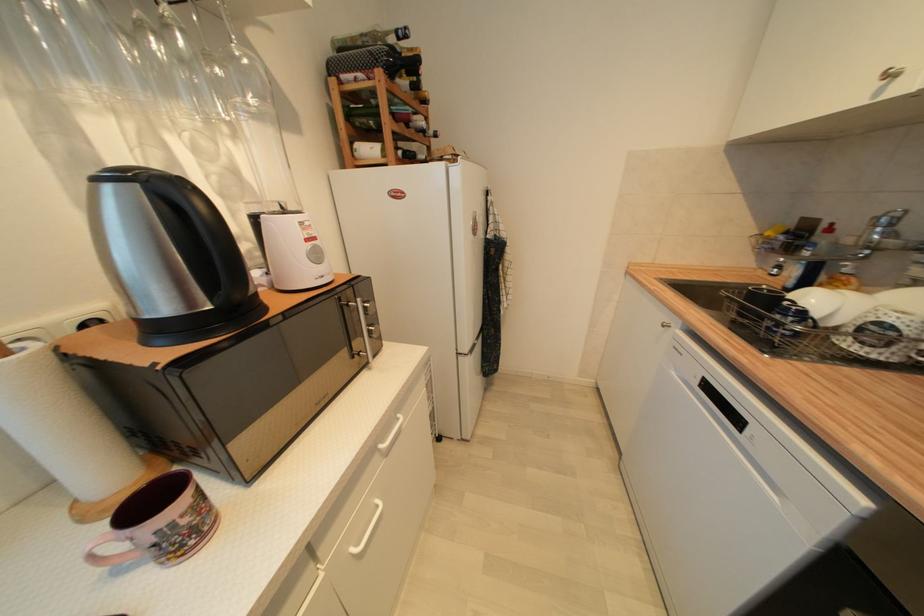
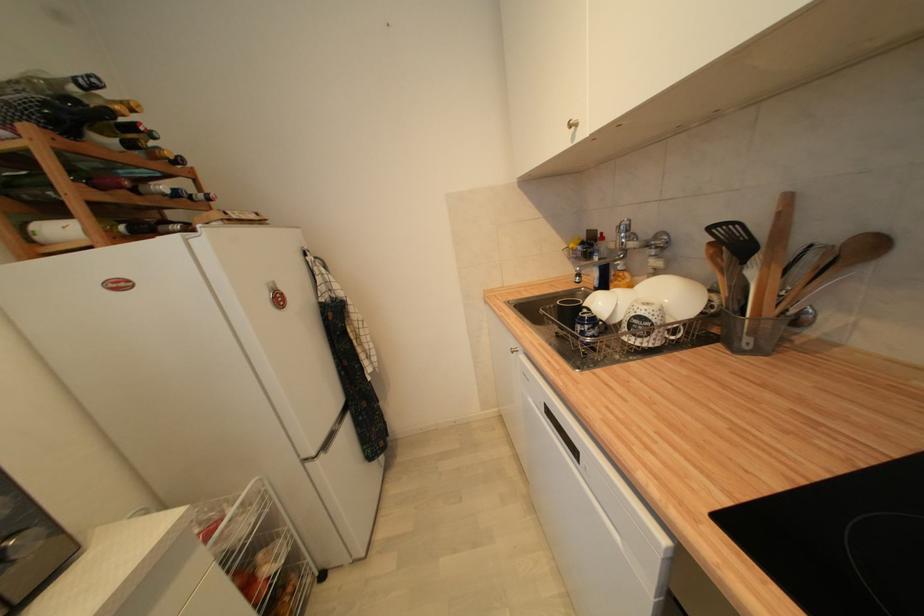
Locate, in the second image, the point that corresponds to point 431,103 in the first image.

(186, 164)